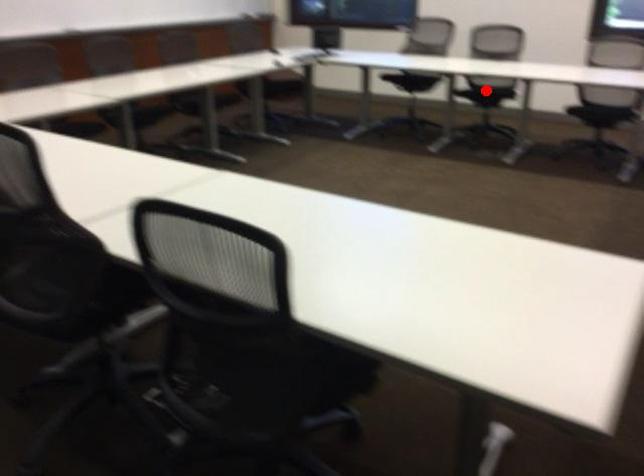
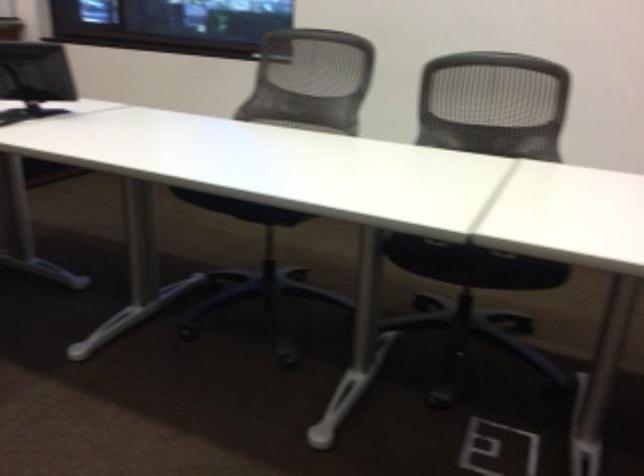
Question: I am providing you with two images of the same scene from different viewpoints. A red point is marked on the first image. At the location where the point appears in image 1, is it still visible in image 2?

Choices:
 (A) Yes
 (B) No

Answer: (B)